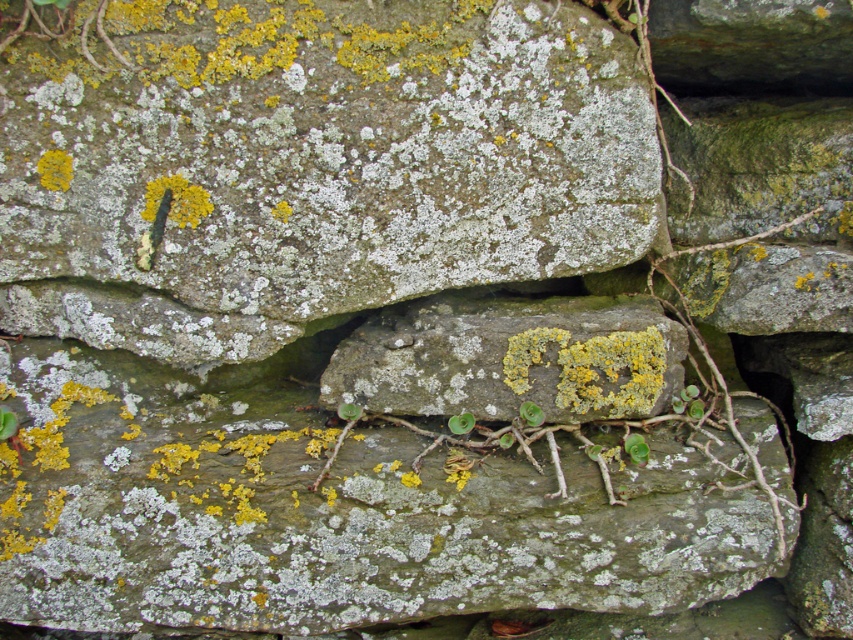
Question: Which object is the closest to the yellow lichen at center?

Choices:
 (A) speckled stone at center
 (B) yellow lichen-covered rock at center

Answer: (B)

Question: Which object is farther from the camera taking this photo?

Choices:
 (A) green leafy plant at center
 (B) yellow lichen at upper left
 (C) yellow lichen-covered rock at center

Answer: (A)

Question: Does yellow lichen at center appear on the left side of yellow lichen at upper left?

Choices:
 (A) no
 (B) yes

Answer: (A)

Question: Does speckled stone at center have a larger size compared to green leafy plant at center?

Choices:
 (A) no
 (B) yes

Answer: (B)

Question: Does speckled stone at center have a greater width compared to yellow lichen at upper left?

Choices:
 (A) yes
 (B) no

Answer: (A)

Question: Which object is the closest to the speckled stone at center?

Choices:
 (A) yellow lichen at upper left
 (B) yellow lichen at center

Answer: (A)